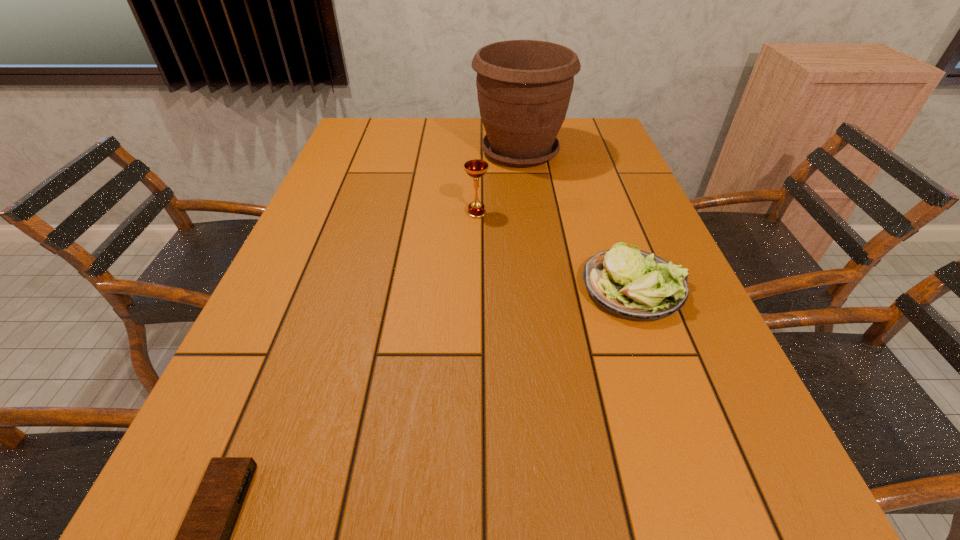
You are a GUI agent. You are given a task and a screenshot of the screen. Output one action in this format:
    pyautogui.click(x=<x>, y=<y>)
    Task: Click on the free space between the third nearest object and the flowerpot
    The height and width of the screenshot is (540, 960).
    Given the screenshot: What is the action you would take?
    pyautogui.click(x=498, y=183)

Where is `vacant area that lies between the flowerpot and the third tallest object`? Image resolution: width=960 pixels, height=540 pixels. vacant area that lies between the flowerpot and the third tallest object is located at coordinates pyautogui.click(x=577, y=220).

What are the coordinates of `object identified as the third closest to the flowerpot` in the screenshot? It's located at (203, 539).

I want to click on the second closest object to the third shortest object, so click(632, 284).

Where is `free spot that satisfies the following two spatial constraints: 1. on the back side of the flowerpot; 2. on the left side of the second farthest object`? The height and width of the screenshot is (540, 960). free spot that satisfies the following two spatial constraints: 1. on the back side of the flowerpot; 2. on the left side of the second farthest object is located at coordinates (477, 152).

Find the location of a particular element. The image size is (960, 540). vacant space that satisfies the following two spatial constraints: 1. on the front side of the third nearest object; 2. on the right side of the lettuce is located at coordinates (476, 287).

The width and height of the screenshot is (960, 540). I want to click on free space that satisfies the following two spatial constraints: 1. on the front side of the third farthest object; 2. on the right side of the second farthest object, so click(476, 287).